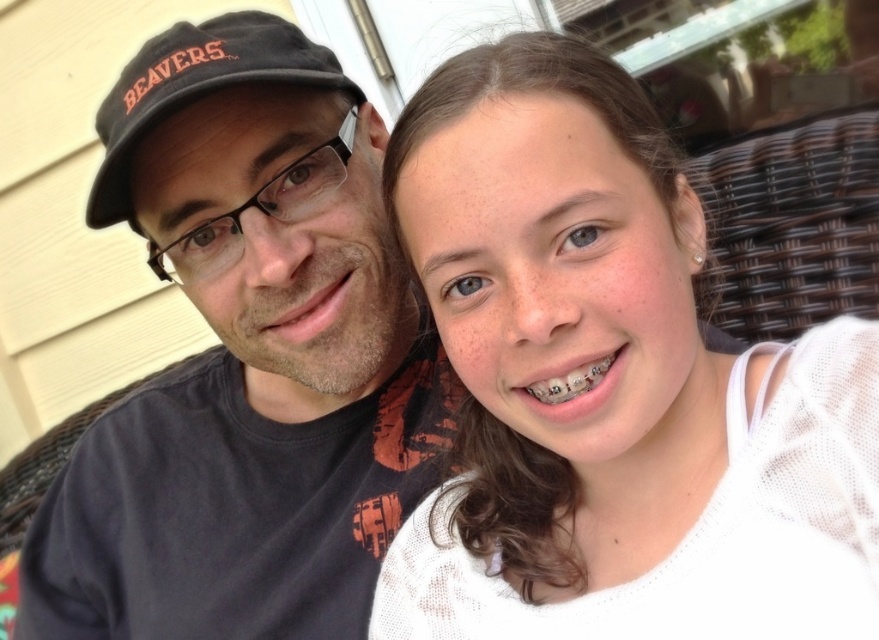
You are standing 20 inches away from the point at coordinates point [548,259]. Can you reach it without moving your feet?

The distance of point [548,259] from viewer is 18.70 inches. Since you are standing 20 inches away, you are farther than the point, so you can reach it without moving your feet.